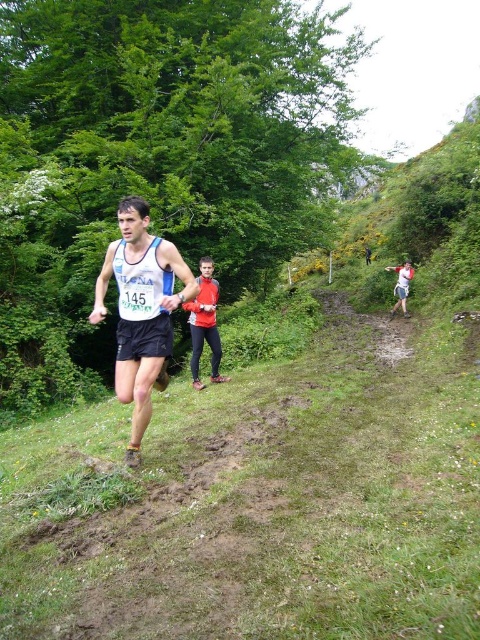
You are a photographer at the trail running event. You want to capture a photo that includes both the matte blue tank top at center and the red fabric jacket at center. Based on their positions, which object should you adjust your camera to focus on first to ensure both are in frame?

The matte blue tank top at center is positioned on the left side of red fabric jacket at center. To include both in the frame, focus on the matte blue tank top at center first as it is on the left, then adjust to include the red fabric jacket at center on the right.

You are a photographer positioned at the starting line of the trail running event. You want to take a photo that includes both the matte blue tank top at center and the red fabric jacket at center. Given that your camera has a maximum focus range of 10 feet, will you be able to capture both subjects in focus?

The distance between the matte blue tank top at center and the red fabric jacket at center is 11.34 feet. Since the camera can only focus within 10 feet, the two subjects are too far apart to both be in focus simultaneously.

You are a drone operator trying to capture aerial footage of the trail event. You need to ensure that the red fabric jacket at center and the white cotton shirt at right are both visible in the frame. Based on their positions, which object should you focus on first to ensure both are in the shot?

The red fabric jacket at center is in front of the white cotton shirt at right, so you should focus on the white cotton shirt at right first to ensure both are visible in the frame.